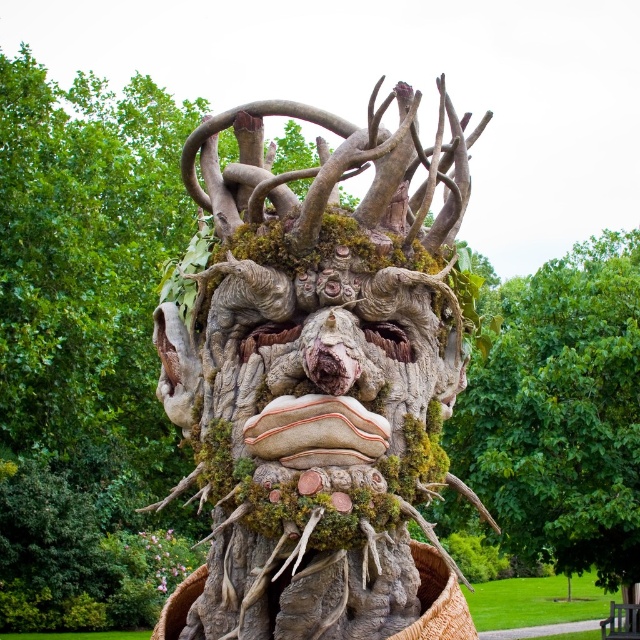
Which is more to the left, rustic wood sculpture at center or mossy bark tree trunk at center?

rustic wood sculpture at center

Is point (275, 320) farther from camera compared to point (588, 508)?

No, it is in front of (588, 508).

Identify the location of rustic wood sculpture at center. Image resolution: width=640 pixels, height=640 pixels. (317, 376).